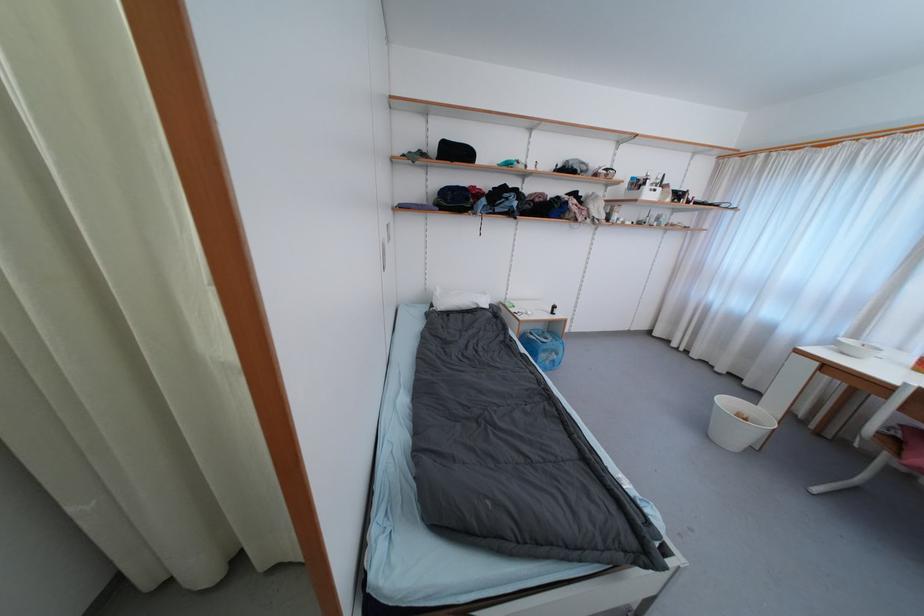
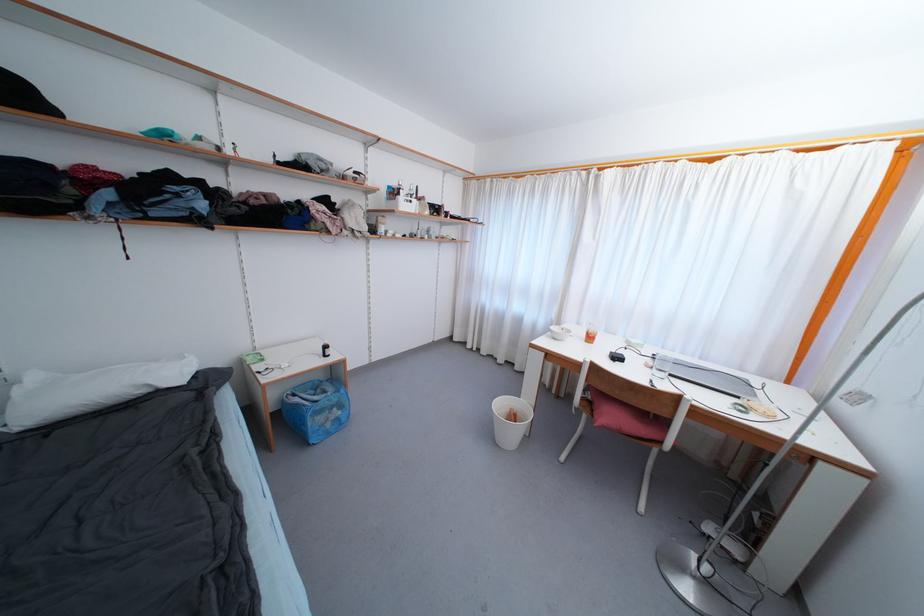
Question: The camera is either moving clockwise (left) or counter-clockwise (right) around the object. The first image is from the beginning of the video and the second image is from the end. Is the camera moving left or right when shooting the video?

Choices:
 (A) Left
 (B) Right

Answer: (A)